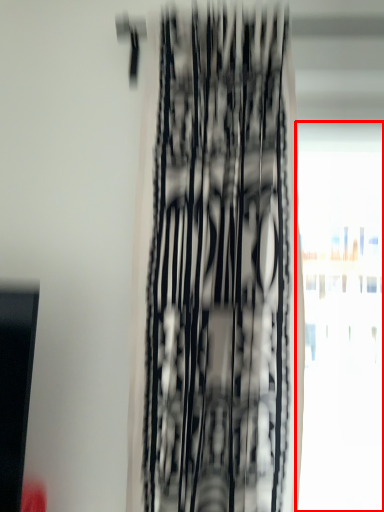
Question: Observing the image, what is the correct spatial positioning of window (annotated by the red box) in reference to curtain?

Choices:
 (A) left
 (B) right

Answer: (B)